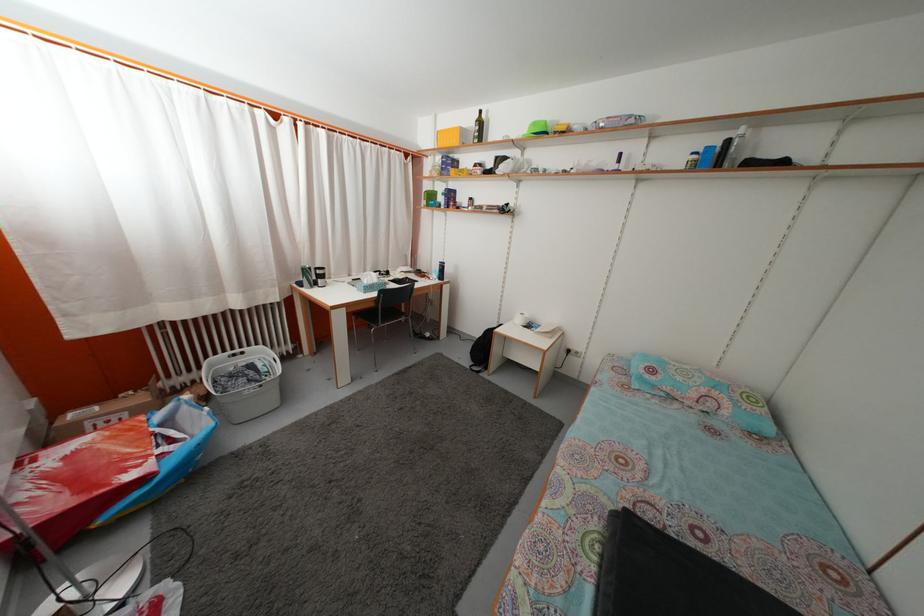
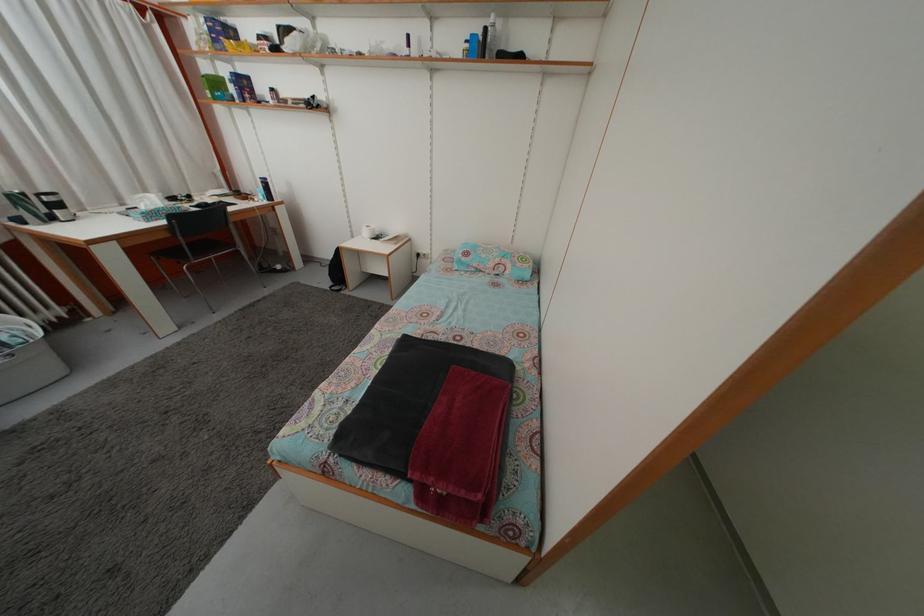
Find the pixel in the second image that matches (x=734, y=148) in the first image.

(492, 38)